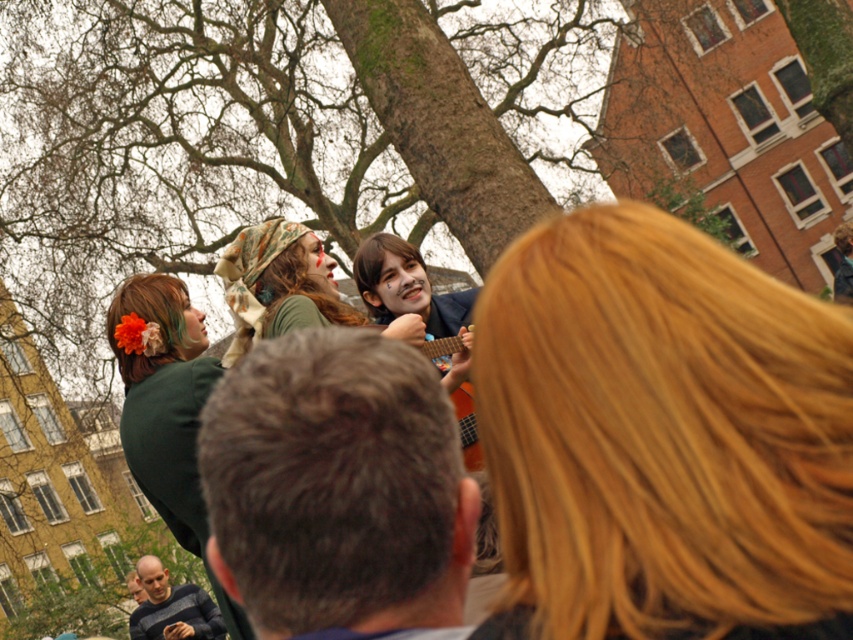
Question: Can you confirm if green fabric flower at upper left is positioned to the left of smooth bald head at lower left?

Choices:
 (A) yes
 (B) no

Answer: (B)

Question: Is blonde hair at center wider than green fabric flower at upper left?

Choices:
 (A) yes
 (B) no

Answer: (B)

Question: Among these objects, which one is farthest from the camera?

Choices:
 (A) blonde hair at center
 (B) green fabric flower at upper left

Answer: (B)

Question: Based on their relative distances, which object is farther from the smooth bald head at lower left?

Choices:
 (A) smooth gray sweater at lower left
 (B) green fabric flower at upper left

Answer: (B)

Question: Which of the following is the closest to the observer?

Choices:
 (A) tap(459, 417)
 (B) tap(410, 372)
 (C) tap(289, 234)

Answer: (B)

Question: Observing the image, what is the correct spatial positioning of blonde hair at center in reference to brown rough bark tree at center?

Choices:
 (A) below
 (B) above

Answer: (A)